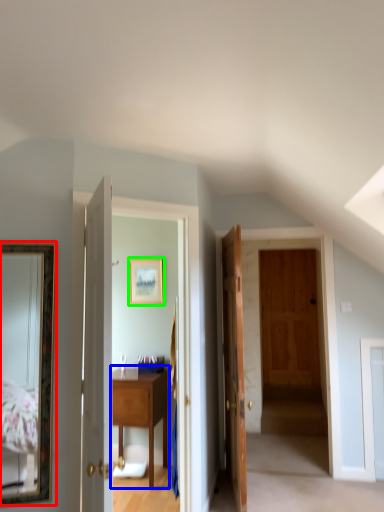
Question: Estimate the real-world distances between objects in this image. Which object is farther from mirror (highlighted by a red box), table (highlighted by a blue box) or picture frame (highlighted by a green box)?

Choices:
 (A) table
 (B) picture frame

Answer: (B)